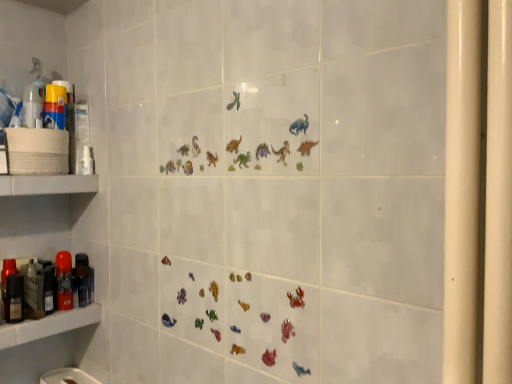
Question: Relative to metallic black hairdryer at left, which is the third toiletry from left to right, is white matte shelf at left, the 1th shelf when ordered from top to bottom, in front or behind?

Choices:
 (A) behind
 (B) front

Answer: (B)

Question: In the image, is white matte shelf at left, the 1th shelf when ordered from top to bottom, on the left side or the right side of metallic black hairdryer at left, which is the third toiletry from left to right?

Choices:
 (A) left
 (B) right

Answer: (A)

Question: Considering the real-world distances, which object is farthest from the translucent plastic spray bottle at left?

Choices:
 (A) matte black soap dispenser at left, the 3th toiletry in the right-to-left sequence
 (B) metallic black hairdryer at left, which is the third toiletry from left to right
 (C) matte plastic shelf at lower left, the 1th shelf in the bottom-to-top sequence
 (D) white matte shelf at left, the 1th shelf when ordered from top to bottom
 (E) matte red spray can at left, the 2th toiletry from the left

Answer: (C)

Question: Which of these objects is positioned farthest from the matte black soap dispenser at left, the 3th toiletry positioned from the back?

Choices:
 (A) white matte shelf at left, the 2th shelf ordered from the bottom
 (B) translucent plastic spray bottle at left
 (C) matte red spray can at left, which appears as the 2th toiletry when viewed from the front
 (D) matte plastic shelf at lower left, which is the 2th shelf in top-to-bottom order
 (E) metallic black hairdryer at left, the third toiletry from the front

Answer: (B)